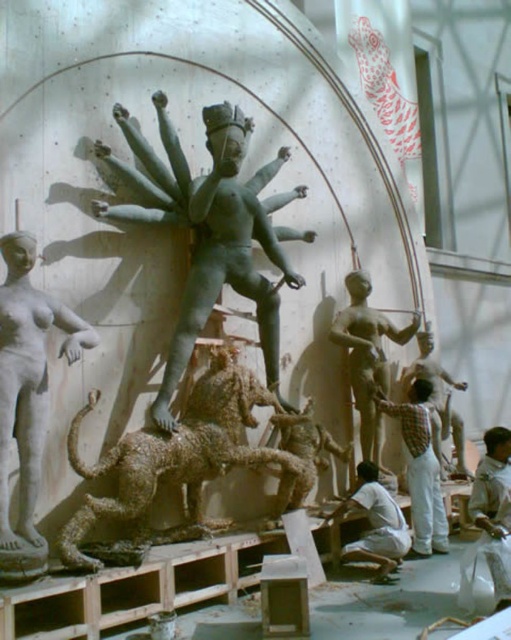
You are an art student visiting the workshop and want to take a photo of both the bronze statue at center and the bronze statue at right. Which statue should you position closer to the camera to ensure both are in frame?

You should position the bronze statue at center closer to the camera because it is to the left of the bronze statue at right, so moving it closer will help both fit within the frame.

You are standing at the entrance of the workshop and want to locate the bronze statue at center. What are the coordinates where you can find it?

The bronze statue at center can be found at coordinates point [208,228].